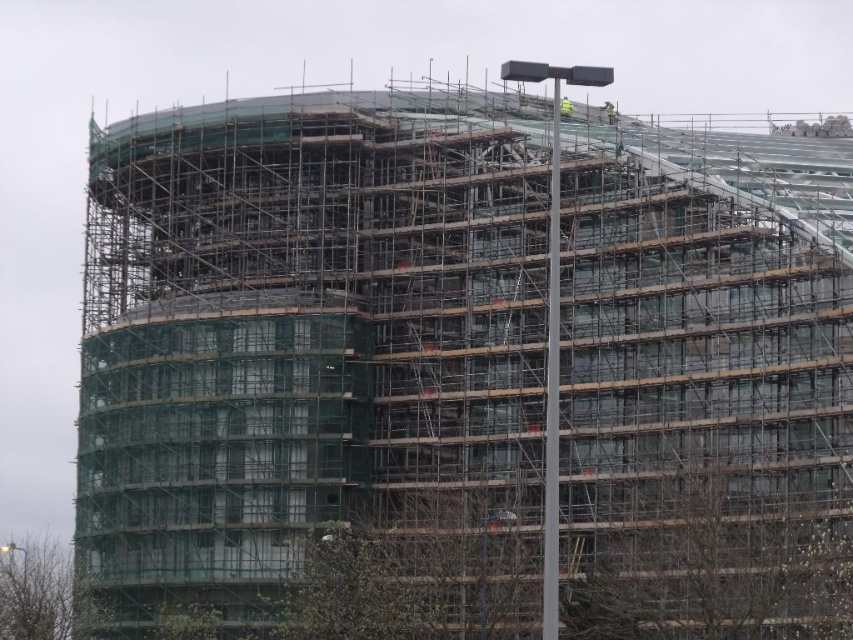
Who is positioned more to the left, green safety helmet at upper center or yellow reflective vest at upper center?

From the viewer's perspective, yellow reflective vest at upper center appears more on the left side.

Is green safety helmet at upper center to the right of yellow reflective vest at upper center from the viewer's perspective?

Correct, you'll find green safety helmet at upper center to the right of yellow reflective vest at upper center.

What do you see at coordinates (610, 113) in the screenshot? The height and width of the screenshot is (640, 853). I see `green safety helmet at upper center` at bounding box center [610, 113].

I want to click on green safety helmet at upper center, so (610, 113).